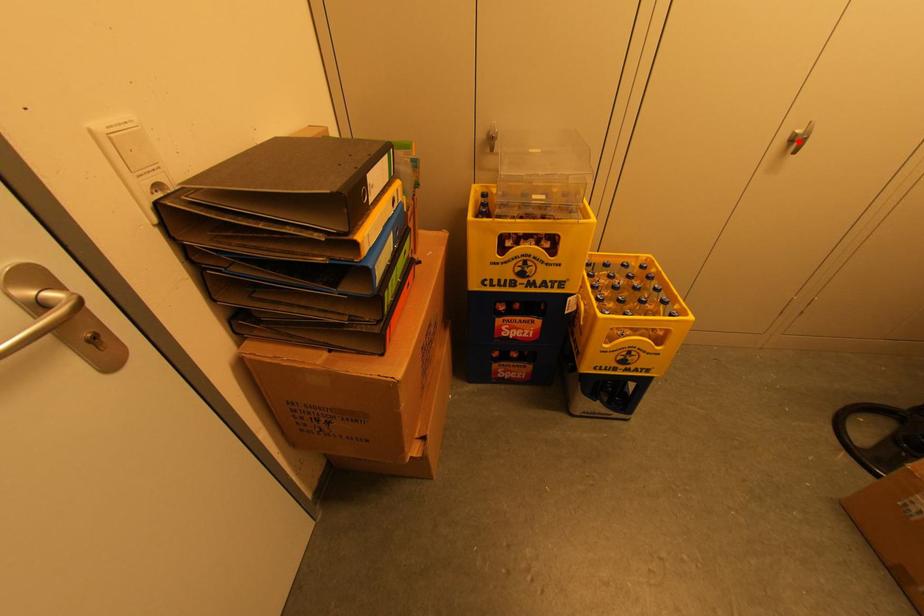
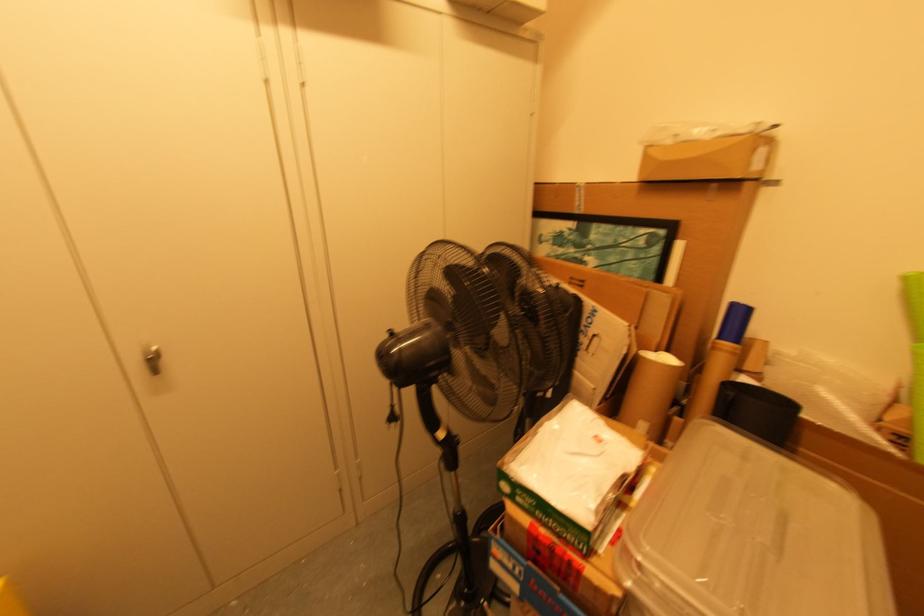
Where in the second image is the point corresponding to the highlighted location from the first image?

(152, 361)